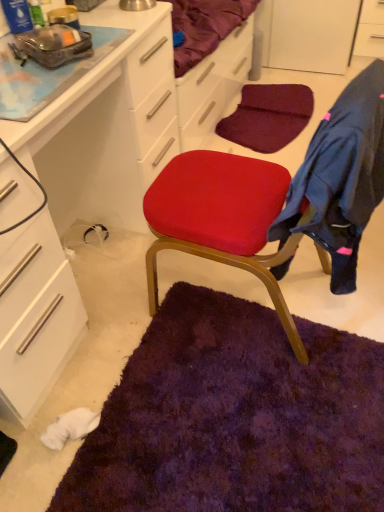
Question: From a real-world perspective, is dark blue fleece jacket at right physically located above or below matte white cabinet at center, placed as the 1th cabinetry when sorted from left to right?

Choices:
 (A) below
 (B) above

Answer: (B)

Question: Choose the correct answer: Is dark blue fleece jacket at right inside matte white cabinet at center, the 1th cabinetry positioned from the front, or outside it?

Choices:
 (A) inside
 (B) outside

Answer: (B)

Question: Which is nearer to the matte white cabinet at center, the 1th cabinetry positioned from the front?

Choices:
 (A) white glossy cabinet at upper right, which ranks as the 2th cabinetry in left-to-right order
 (B) dark blue fleece jacket at right

Answer: (B)

Question: Considering the real-world distances, which object is closest to the dark blue fleece jacket at right?

Choices:
 (A) matte white cabinet at center, which ranks as the 2th cabinetry in right-to-left order
 (B) white glossy cabinet at upper right, placed as the first cabinetry when sorted from top to bottom

Answer: (A)